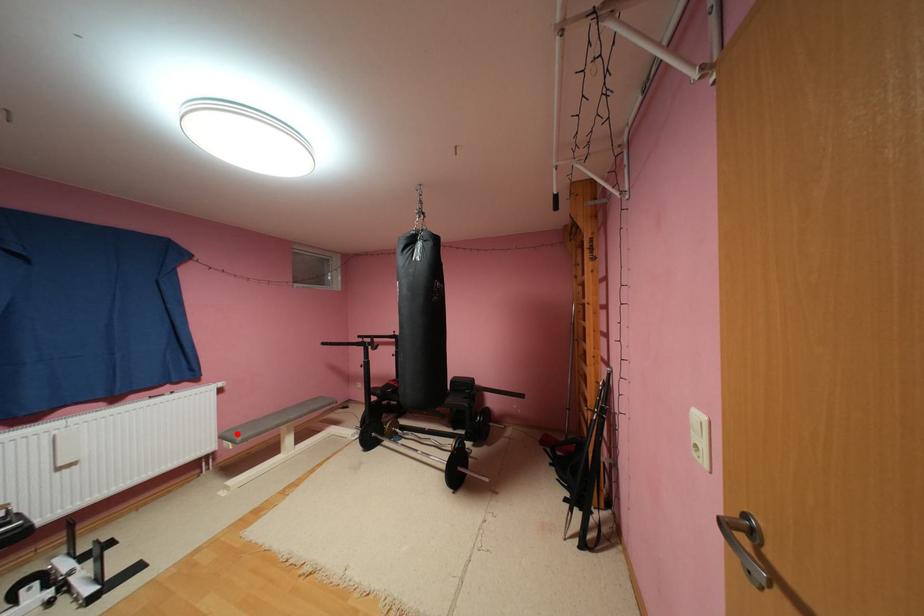
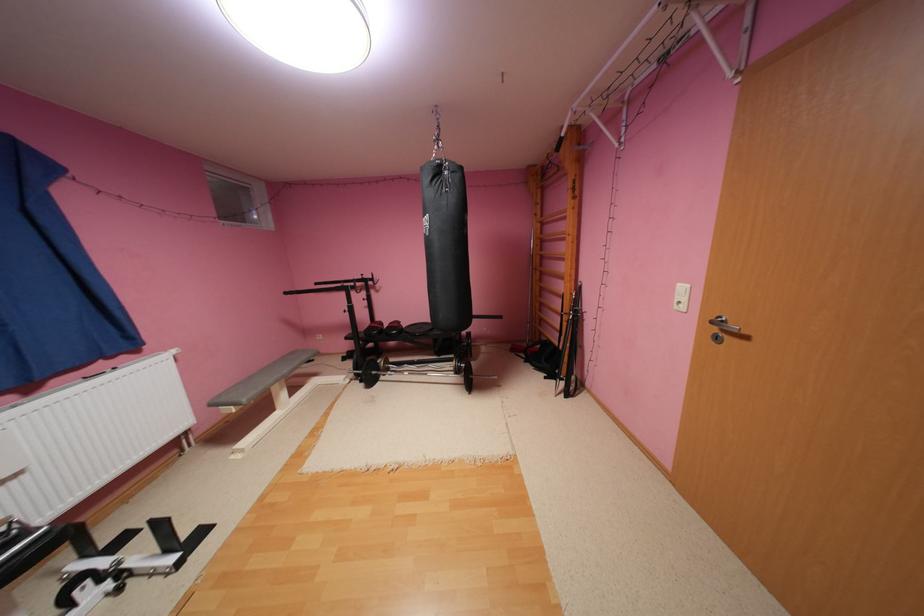
Question: I am providing you with two images of the same scene from different viewpoints. A red point is marked on the first image. Is the red point's position out of view in image 2?

Choices:
 (A) Yes
 (B) No

Answer: (B)